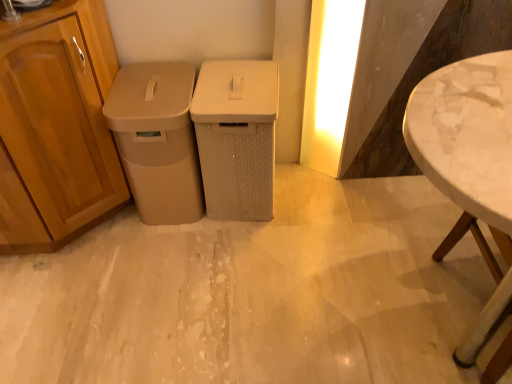
At what (x,y) coordinates should I click in order to perform the action: click on beige matte trash can at left, positioned as the first waste container in left-to-right order. Please return your answer as a coordinate pair (x, y). This screenshot has height=384, width=512. Looking at the image, I should click on (157, 140).

What do you see at coordinates (336, 65) in the screenshot? This screenshot has width=512, height=384. I see `yellow matte light at upper right` at bounding box center [336, 65].

This screenshot has width=512, height=384. What are the coordinates of `beige matte trash can at left, which appears as the 2th waste container when viewed from the right` in the screenshot? It's located at (157, 140).

Measure the distance between beige matte trash can at left, which appears as the 2th waste container when viewed from the right, and yellow matte light at upper right.

beige matte trash can at left, which appears as the 2th waste container when viewed from the right, is 65.07 centimeters from yellow matte light at upper right.

Does beige matte trash can at left, positioned as the first waste container in left-to-right order, have a lesser width compared to yellow matte light at upper right?

In fact, beige matte trash can at left, positioned as the first waste container in left-to-right order, might be wider than yellow matte light at upper right.

Relative to yellow matte light at upper right, is beige matte trash can at left, positioned as the first waste container in left-to-right order, in front or behind?

beige matte trash can at left, positioned as the first waste container in left-to-right order, is positioned closer to the viewer than yellow matte light at upper right.

This screenshot has height=384, width=512. Find the location of `the 2nd waste container in front of the yellow matte light at upper right, starting your count from the anchor`. the 2nd waste container in front of the yellow matte light at upper right, starting your count from the anchor is located at coordinates (157, 140).

Are white marble table at right and beige matte trash can at left, positioned as the first waste container in left-to-right order, located far from each other?

No.

From the image's perspective, which waste container is the 1st one above the white marble table at right? Please provide its 2D coordinates.

[(157, 140)]

Considering the points (485, 129) and (142, 210), which point is behind, point (485, 129) or point (142, 210)?

The point (142, 210) is farther from the camera.

How distant is beige textured waste bin at center, positioned as the 1th waste container in right-to-left order, from yellow matte light at upper right?

The distance of beige textured waste bin at center, positioned as the 1th waste container in right-to-left order, from yellow matte light at upper right is 15.77 inches.

Can you tell me how much beige textured waste bin at center, which appears as the second waste container when viewed from the left, and yellow matte light at upper right differ in facing direction?

They differ by 45.9 degrees in their facing directions.

Is beige textured waste bin at center, positioned as the 1th waste container in right-to-left order, oriented away from yellow matte light at upper right?

beige textured waste bin at center, positioned as the 1th waste container in right-to-left order, does not have its back to yellow matte light at upper right.

Considering their positions, is beige textured waste bin at center, which appears as the second waste container when viewed from the left, located in front of or behind yellow matte light at upper right?

In the image, beige textured waste bin at center, which appears as the second waste container when viewed from the left, appears in front of yellow matte light at upper right.

Is beige matte trash can at left, positioned as the first waste container in left-to-right order, a part of yellow matte light at upper right?

No, beige matte trash can at left, positioned as the first waste container in left-to-right order, is not surrounded by yellow matte light at upper right.

Which is behind, point (327, 22) or point (122, 90)?

The point (327, 22) is more distant.

Are yellow matte light at upper right and beige matte trash can at left, which appears as the 2th waste container when viewed from the right, making contact?

yellow matte light at upper right is not next to beige matte trash can at left, which appears as the 2th waste container when viewed from the right, and they're not touching.

From a real-world perspective, is yellow matte light at upper right positioned under beige matte trash can at left, positioned as the first waste container in left-to-right order, based on gravity?

Actually, yellow matte light at upper right is physically above beige matte trash can at left, positioned as the first waste container in left-to-right order, in the real world.

Is white marble table at right in front of or behind yellow matte light at upper right in the image?

white marble table at right is positioned closer to the viewer than yellow matte light at upper right.

Is white marble table at right turned away from yellow matte light at upper right?

No, yellow matte light at upper right is not at the back of white marble table at right.

Is white marble table at right to the right of yellow matte light at upper right from the viewer's perspective?

Indeed, white marble table at right is positioned on the right side of yellow matte light at upper right.

Considering the sizes of white marble table at right and yellow matte light at upper right in the image, is white marble table at right wider or thinner than yellow matte light at upper right?

Considering their sizes, white marble table at right looks broader than yellow matte light at upper right.

Is yellow matte light at upper right to the left of white marble table at right from the viewer's perspective?

Indeed, yellow matte light at upper right is positioned on the left side of white marble table at right.

Is point (321, 61) positioned behind point (493, 151)?

Yes, point (321, 61) is farther from viewer.

Which of these two, yellow matte light at upper right or white marble table at right, is smaller?

Smaller between the two is yellow matte light at upper right.

This screenshot has height=384, width=512. I want to click on light above the white marble table at right (from the image's perspective), so click(336, 65).

Is beige matte trash can at left, positioned as the first waste container in left-to-right order, far away from white marble table at right?

No, beige matte trash can at left, positioned as the first waste container in left-to-right order, is in close proximity to white marble table at right.

Which of these two, beige matte trash can at left, which appears as the 2th waste container when viewed from the right, or white marble table at right, stands shorter?

beige matte trash can at left, which appears as the 2th waste container when viewed from the right, is shorter.

Visually, is beige matte trash can at left, which appears as the 2th waste container when viewed from the right, positioned to the left or to the right of white marble table at right?

From the image, it's evident that beige matte trash can at left, which appears as the 2th waste container when viewed from the right, is to the left of white marble table at right.

Is point (189, 97) closer or farther from the camera than point (499, 309)?

Point (189, 97) is positioned farther from the camera compared to point (499, 309).

Where is `light that is behind the beige matte trash can at left, positioned as the first waste container in left-to-right order`? light that is behind the beige matte trash can at left, positioned as the first waste container in left-to-right order is located at coordinates (336, 65).

You are a GUI agent. You are given a task and a screenshot of the screen. Output one action in this format:
    pyautogui.click(x=<x>, y=<y>)
    Task: Click on the table above the beige matte trash can at left, which appears as the 2th waste container when viewed from the right (from a real-world perspective)
    The height and width of the screenshot is (384, 512).
    Given the screenshot: What is the action you would take?
    pyautogui.click(x=469, y=165)

From the image, which object appears to be farther from beige textured waste bin at center, which appears as the second waste container when viewed from the left, white marble table at right or yellow matte light at upper right?

The object further to beige textured waste bin at center, which appears as the second waste container when viewed from the left, is white marble table at right.

From the image, which object appears to be farther from white marble table at right, yellow matte light at upper right or beige textured waste bin at center, which appears as the second waste container when viewed from the left?

beige textured waste bin at center, which appears as the second waste container when viewed from the left, is further to white marble table at right.

Looking at the image, which one is located further to beige matte trash can at left, which appears as the 2th waste container when viewed from the right, white marble table at right or beige textured waste bin at center, which appears as the second waste container when viewed from the left?

white marble table at right lies further to beige matte trash can at left, which appears as the 2th waste container when viewed from the right, than the other object.

Looking at the image, which one is located closer to beige matte trash can at left, which appears as the 2th waste container when viewed from the right, yellow matte light at upper right or white marble table at right?

yellow matte light at upper right is positioned closer to the anchor beige matte trash can at left, which appears as the 2th waste container when viewed from the right.

Estimate the real-world distances between objects in this image. Which object is closer to yellow matte light at upper right, beige textured waste bin at center, positioned as the 1th waste container in right-to-left order, or beige matte trash can at left, which appears as the 2th waste container when viewed from the right?

beige textured waste bin at center, positioned as the 1th waste container in right-to-left order, is positioned closer to the anchor yellow matte light at upper right.

When comparing their distances from beige matte trash can at left, which appears as the 2th waste container when viewed from the right, does beige textured waste bin at center, which appears as the second waste container when viewed from the left, or yellow matte light at upper right seem closer?

Based on the image, beige textured waste bin at center, which appears as the second waste container when viewed from the left, appears to be nearer to beige matte trash can at left, which appears as the 2th waste container when viewed from the right.

From the image, which object appears to be nearer to yellow matte light at upper right, beige textured waste bin at center, positioned as the 1th waste container in right-to-left order, or white marble table at right?

beige textured waste bin at center, positioned as the 1th waste container in right-to-left order, is positioned closer to the anchor yellow matte light at upper right.

In the scene shown: Based on their spatial positions, is yellow matte light at upper right or beige matte trash can at left, positioned as the first waste container in left-to-right order, closer to white marble table at right?

yellow matte light at upper right is closer to white marble table at right.

At what (x,y) coordinates should I click in order to perform the action: click on waste container located between beige matte trash can at left, positioned as the first waste container in left-to-right order, and yellow matte light at upper right in the left-right direction. Please return your answer as a coordinate pair (x, y). Image resolution: width=512 pixels, height=384 pixels. Looking at the image, I should click on click(x=236, y=137).

Where is `light located between beige matte trash can at left, positioned as the first waste container in left-to-right order, and white marble table at right in the left-right direction`? light located between beige matte trash can at left, positioned as the first waste container in left-to-right order, and white marble table at right in the left-right direction is located at coordinates (336, 65).

The height and width of the screenshot is (384, 512). What are the coordinates of `waste container between beige matte trash can at left, which appears as the 2th waste container when viewed from the right, and white marble table at right from left to right` in the screenshot? It's located at (236, 137).